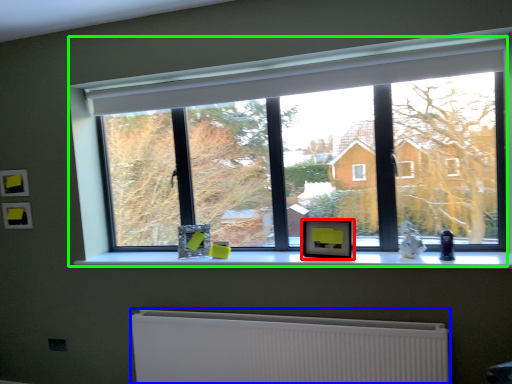
Question: Which object is positioned farthest from picture frame (highlighted by a red box)? Select from radiator (highlighted by a blue box) and window (highlighted by a green box).

Choices:
 (A) radiator
 (B) window

Answer: (B)